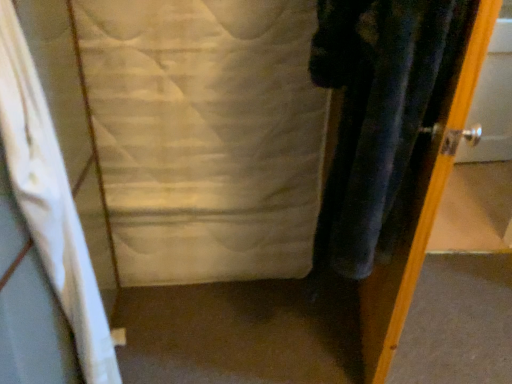
Question: From a real-world perspective, relative to white fabric curtain at left, is white quilted fabric at center vertically above or below?

Choices:
 (A) above
 (B) below

Answer: (B)

Question: Considering the positions of white quilted fabric at center and white fabric curtain at left in the image, is white quilted fabric at center taller or shorter than white fabric curtain at left?

Choices:
 (A) tall
 (B) short

Answer: (B)

Question: Considering the real-world distances, which object is farthest from the metallic silver door at right?

Choices:
 (A) white fabric curtain at left
 (B) white quilted fabric at center

Answer: (A)

Question: Considering the real-world distances, which object is farthest from the white quilted fabric at center?

Choices:
 (A) metallic silver door at right
 (B) white fabric curtain at left

Answer: (A)